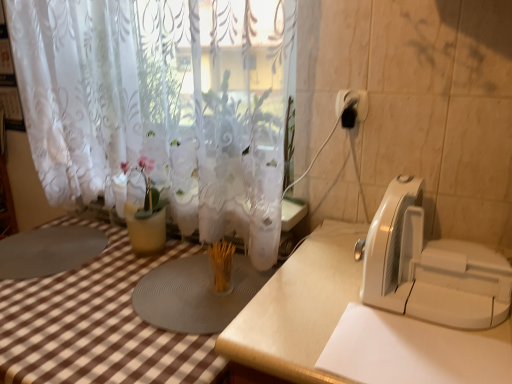
The width and height of the screenshot is (512, 384). What do you see at coordinates (161, 104) in the screenshot?
I see `white lace curtain at upper center` at bounding box center [161, 104].

Identify the location of white lace curtain at upper center. Image resolution: width=512 pixels, height=384 pixels. (161, 104).

Find the location of a particular element. The height and width of the screenshot is (384, 512). white plastic appliance at right is located at coordinates (429, 267).

Measure the distance between white plastic appliance at right and camera.

The depth of white plastic appliance at right is 31.52 inches.

What do you see at coordinates (352, 107) in the screenshot?
I see `black plastic electric outlet at upper right` at bounding box center [352, 107].

This screenshot has height=384, width=512. I want to click on white lace curtain at upper center, so click(x=161, y=104).

Does white lace curtain at upper center touch white plastic appliance at right?

No.

Which of these two, white lace curtain at upper center or white plastic appliance at right, is thinner?

With smaller width is white lace curtain at upper center.

From a real-world perspective, who is located lower, white lace curtain at upper center or white plastic appliance at right?

white plastic appliance at right.

Is white lace curtain at upper center oriented away from white plastic appliance at right?

That's not correct — white lace curtain at upper center is not looking away from white plastic appliance at right.

Would you say white plastic appliance at right is to the left or to the right of white matte table at center in the picture?

From the image, it's evident that white plastic appliance at right is to the right of white matte table at center.

Which object is closer to the camera taking this photo, white plastic appliance at right or white matte table at center?

Positioned in front is white matte table at center.

Which of these two, white plastic appliance at right or white matte table at center, stands shorter?

With less height is white plastic appliance at right.

Considering the sizes of black plastic electric outlet at upper right and white matte table at center in the image, is black plastic electric outlet at upper right wider or thinner than white matte table at center?

black plastic electric outlet at upper right is thinner than white matte table at center.

Is black plastic electric outlet at upper right facing away from white matte table at center?

That's not correct — black plastic electric outlet at upper right is not looking away from white matte table at center.

Is black plastic electric outlet at upper right positioned far away from white matte table at center?

They are positioned close to each other.

Is white lace curtain at upper center completely or partially outside of white matte table at center?

Yes, white lace curtain at upper center is outside of white matte table at center.

Measure the distance from white lace curtain at upper center to white matte table at center.

white lace curtain at upper center and white matte table at center are 19.94 inches apart from each other.

How many degrees apart are the facing directions of white lace curtain at upper center and white matte table at center?

The angular difference between white lace curtain at upper center and white matte table at center is 0.00162 degrees.

Is white lace curtain at upper center with white matte table at center?

No, white lace curtain at upper center is not next to white matte table at center.

In the scene shown: How many degrees apart are the facing directions of black plastic electric outlet at upper right and white plastic appliance at right?

1.2 degrees separate the facing orientations of black plastic electric outlet at upper right and white plastic appliance at right.

Is black plastic electric outlet at upper right facing towards white plastic appliance at right?

No, black plastic electric outlet at upper right is not oriented towards white plastic appliance at right.

Identify the location of electric outlet that appears above the white plastic appliance at right (from the image's perspective). (352, 107).

From the picture: Would you consider black plastic electric outlet at upper right to be distant from white plastic appliance at right?

No, there isn't a large distance between black plastic electric outlet at upper right and white plastic appliance at right.

Which is correct: white matte table at center is inside white lace curtain at upper center, or outside of it?

white matte table at center cannot be found inside white lace curtain at upper center.

Is white matte table at center positioned with its back to white lace curtain at upper center?

No.

The width and height of the screenshot is (512, 384). I want to click on table on the right of white lace curtain at upper center, so click(x=296, y=311).

From a real-world perspective, is white matte table at center beneath white lace curtain at upper center?

Yes, from a real-world perspective, white matte table at center is below white lace curtain at upper center.

In the scene shown: Is white matte table at center turned away from white plastic appliance at right?

No, white matte table at center is not facing away from white plastic appliance at right.

Where is `appliance that appears above the white matte table at center (from a real-world perspective)`? appliance that appears above the white matte table at center (from a real-world perspective) is located at coordinates (429, 267).

Between white matte table at center and white plastic appliance at right, which one has less height?

white plastic appliance at right.

Is white matte table at center at the right side of white plastic appliance at right?

No, white matte table at center is not to the right of white plastic appliance at right.

This screenshot has width=512, height=384. I want to click on appliance below the white lace curtain at upper center (from the image's perspective), so click(x=429, y=267).

This screenshot has height=384, width=512. I want to click on table on the left of white plastic appliance at right, so click(296, 311).

Which object lies nearer to the anchor point white matte table at center, white lace curtain at upper center or white plastic appliance at right?

Among the two, white plastic appliance at right is located nearer to white matte table at center.

Estimate the real-world distances between objects in this image. Which object is further from white lace curtain at upper center, white matte table at center or white plastic appliance at right?

Among the two, white plastic appliance at right is located further to white lace curtain at upper center.

Estimate the real-world distances between objects in this image. Which object is closer to black plastic electric outlet at upper right, white lace curtain at upper center or white plastic appliance at right?

Based on the image, white plastic appliance at right appears to be nearer to black plastic electric outlet at upper right.

Looking at this image, which object lies further to the anchor point white lace curtain at upper center, white plastic appliance at right or black plastic electric outlet at upper right?

Based on the image, white plastic appliance at right appears to be further to white lace curtain at upper center.

Considering their positions, is black plastic electric outlet at upper right positioned further to white matte table at center than white lace curtain at upper center?

Based on the image, white lace curtain at upper center appears to be further to white matte table at center.

Considering their positions, is white lace curtain at upper center positioned closer to white plastic appliance at right than white matte table at center?

Based on the image, white matte table at center appears to be nearer to white plastic appliance at right.

From the image, which object appears to be nearer to white plastic appliance at right, white matte table at center or black plastic electric outlet at upper right?

Among the two, white matte table at center is located nearer to white plastic appliance at right.

From the image, which object appears to be nearer to white matte table at center, white plastic appliance at right or white lace curtain at upper center?

Based on the image, white plastic appliance at right appears to be nearer to white matte table at center.

Where is `electric outlet located between white lace curtain at upper center and white plastic appliance at right in the left-right direction`? This screenshot has width=512, height=384. electric outlet located between white lace curtain at upper center and white plastic appliance at right in the left-right direction is located at coordinates (352, 107).

Identify the location of electric outlet between white lace curtain at upper center and white matte table at center in the vertical direction. (352, 107).

At what (x,y) coordinates should I click in order to perform the action: click on appliance between black plastic electric outlet at upper right and white matte table at center vertically. Please return your answer as a coordinate pair (x, y). The width and height of the screenshot is (512, 384). Looking at the image, I should click on (429, 267).

This screenshot has height=384, width=512. Identify the location of table between white lace curtain at upper center and white plastic appliance at right in the horizontal direction. [x=296, y=311].